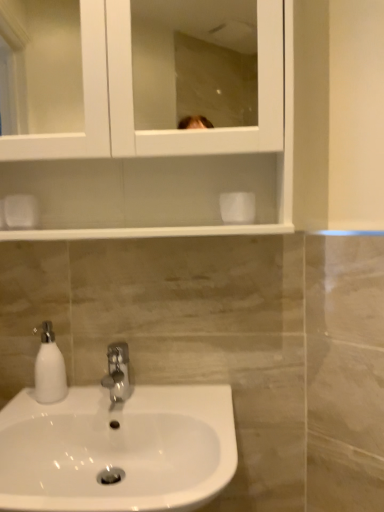
Question: Is white glossy soap dispenser at lower left closer to camera compared to white glossy medicine cabinet at upper center?

Choices:
 (A) no
 (B) yes

Answer: (A)

Question: From a real-world perspective, is white glossy soap dispenser at lower left positioned over white glossy medicine cabinet at upper center based on gravity?

Choices:
 (A) no
 (B) yes

Answer: (A)

Question: From a real-world perspective, is white glossy soap dispenser at lower left under white glossy medicine cabinet at upper center?

Choices:
 (A) yes
 (B) no

Answer: (A)

Question: Does white glossy soap dispenser at lower left have a lesser width compared to white glossy medicine cabinet at upper center?

Choices:
 (A) yes
 (B) no

Answer: (A)

Question: Is white glossy soap dispenser at lower left oriented towards white glossy medicine cabinet at upper center?

Choices:
 (A) yes
 (B) no

Answer: (B)

Question: Considering the positions of white glossy medicine cabinet at upper center and white glossy soap dispenser at lower left in the image, is white glossy medicine cabinet at upper center bigger or smaller than white glossy soap dispenser at lower left?

Choices:
 (A) big
 (B) small

Answer: (A)

Question: Considering the relative positions of white glossy medicine cabinet at upper center and white glossy soap dispenser at lower left in the image provided, is white glossy medicine cabinet at upper center to the left or to the right of white glossy soap dispenser at lower left?

Choices:
 (A) left
 (B) right

Answer: (B)

Question: From the image's perspective, is white glossy medicine cabinet at upper center above or below white glossy soap dispenser at lower left?

Choices:
 (A) above
 (B) below

Answer: (A)

Question: Looking at their shapes, would you say white glossy medicine cabinet at upper center is wider or thinner than white glossy soap dispenser at lower left?

Choices:
 (A) wide
 (B) thin

Answer: (A)

Question: From a real-world perspective, is polished chrome faucet at center physically located above or below white glossy sink at lower left?

Choices:
 (A) above
 (B) below

Answer: (A)

Question: From the image's perspective, is polished chrome faucet at center located above or below white glossy sink at lower left?

Choices:
 (A) above
 (B) below

Answer: (A)

Question: Relative to white glossy sink at lower left, is polished chrome faucet at center in front or behind?

Choices:
 (A) front
 (B) behind

Answer: (B)

Question: Does point (114, 392) appear closer or farther from the camera than point (178, 484)?

Choices:
 (A) closer
 (B) farther

Answer: (B)

Question: Relative to white glossy soap dispenser at lower left, is white glossy sink at lower left in front or behind?

Choices:
 (A) behind
 (B) front

Answer: (B)

Question: Would you say white glossy sink at lower left is inside or outside white glossy soap dispenser at lower left?

Choices:
 (A) inside
 (B) outside

Answer: (B)